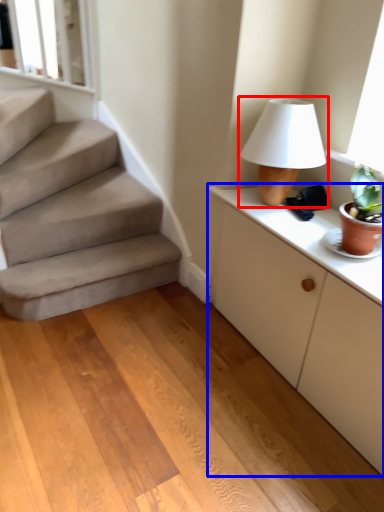
Question: Which object appears farthest to the camera in this image, table lamp (highlighted by a red box) or cabinetry (highlighted by a blue box)?

Choices:
 (A) table lamp
 (B) cabinetry

Answer: (A)